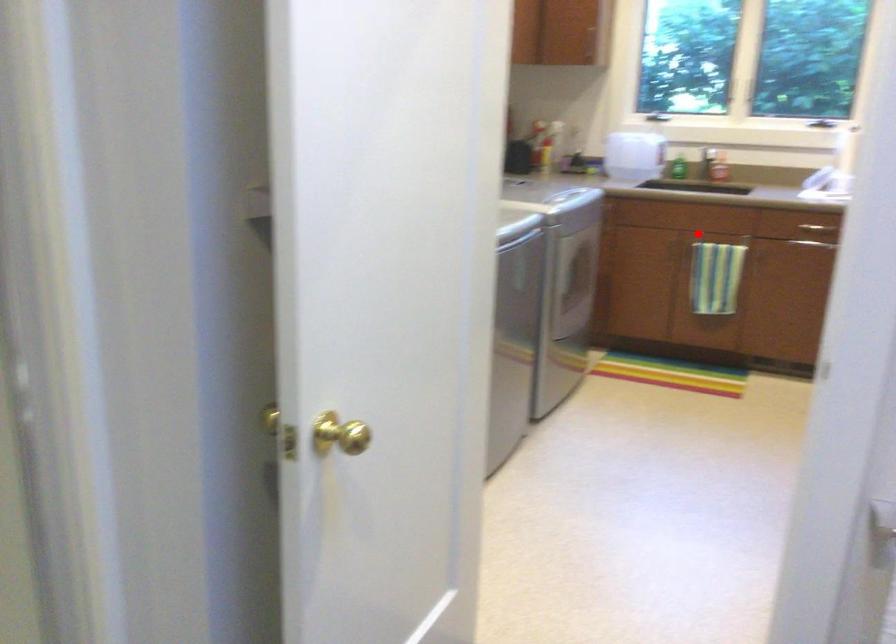
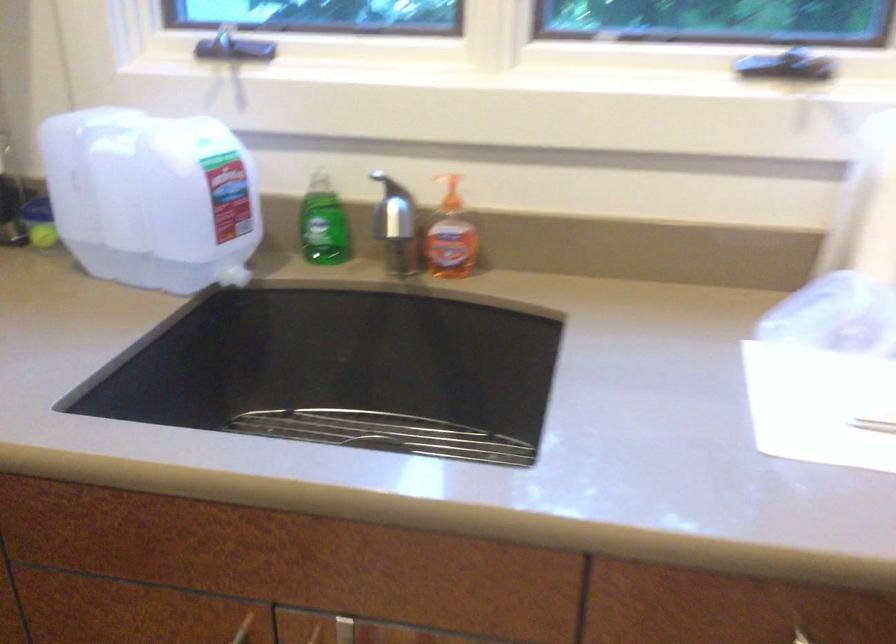
Question: I am providing you with two images of the same scene from different viewpoints. Image1 has a red point marked. In image2, the corresponding 3D location appears at what relative position? Reply with the corresponding letter.

Choices:
 (A) Closer
 (B) Farther

Answer: (A)